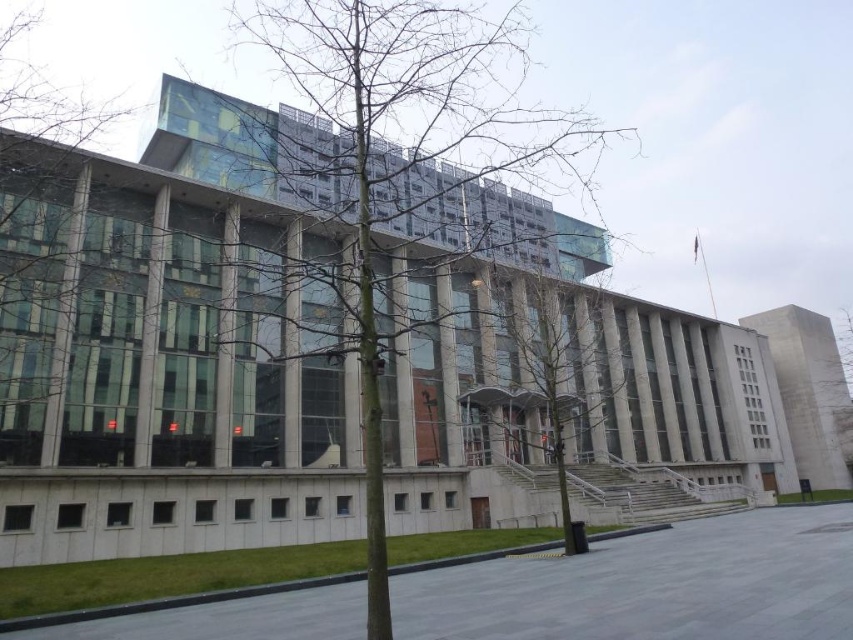
Question: Which is nearer to the bare branches at center?

Choices:
 (A) green leafless tree at right
 (B) green leafless tree at left

Answer: (B)

Question: Which point is farther to the camera?

Choices:
 (A) green leafless tree at right
 (B) bare branches at center
 (C) green leafless tree at left
 (D) green leafless tree at center

Answer: (A)

Question: Is green leafless tree at left to the left of green leafless tree at right from the viewer's perspective?

Choices:
 (A) no
 (B) yes

Answer: (B)

Question: Is green leafless tree at left positioned before green leafless tree at right?

Choices:
 (A) yes
 (B) no

Answer: (A)

Question: Which point is farther from the camera taking this photo?

Choices:
 (A) (502, 38)
 (B) (577, 346)
 (C) (840, 314)
 (D) (91, 134)

Answer: (C)

Question: Where is bare branches at center located in relation to green leafless tree at right in the image?

Choices:
 (A) above
 (B) below

Answer: (A)